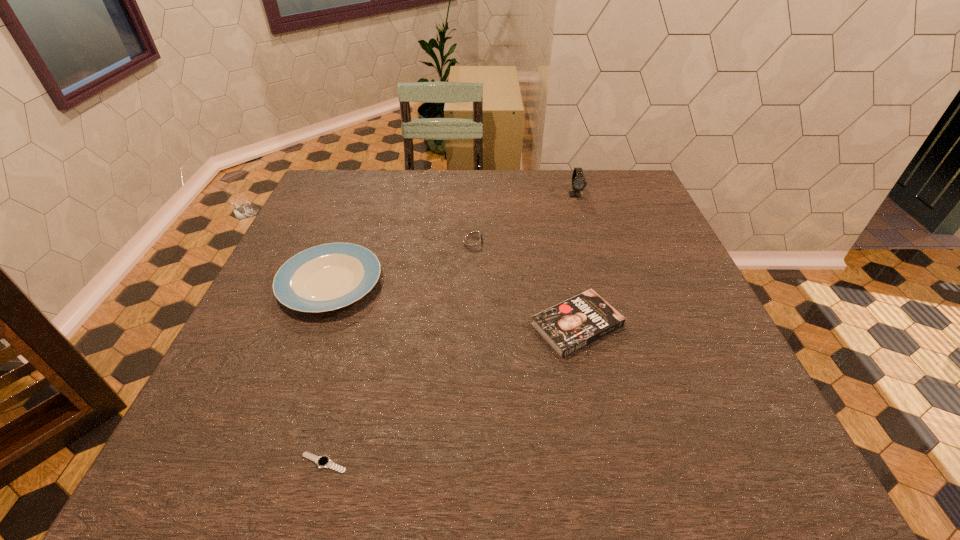
Find the location of `the farthest watch`. the farthest watch is located at coordinates (578, 180).

The height and width of the screenshot is (540, 960). In order to click on the farthest object in this screenshot , I will do `click(578, 180)`.

You are a GUI agent. You are given a task and a screenshot of the screen. Output one action in this format:
    pyautogui.click(x=<x>, y=<y>)
    Task: Click on the plate
    The image size is (960, 540).
    Given the screenshot: What is the action you would take?
    pyautogui.click(x=326, y=277)

This screenshot has height=540, width=960. In order to click on the second shortest watch in this screenshot , I will do pyautogui.click(x=473, y=240).

Identify the location of the third object from left to right. This screenshot has height=540, width=960. (473, 240).

You are a GUI agent. You are given a task and a screenshot of the screen. Output one action in this format:
    pyautogui.click(x=<x>, y=<y>)
    Task: Click on the book
    The height and width of the screenshot is (540, 960).
    Given the screenshot: What is the action you would take?
    577,322

Identify the location of the nearest object. (322, 461).

Identify the location of the shortest watch. The image size is (960, 540). (322, 461).

This screenshot has width=960, height=540. Find the location of `vacant space located on the face of the tallest object`. vacant space located on the face of the tallest object is located at coordinates (596, 264).

This screenshot has height=540, width=960. Find the location of `free region located 0.080m on the front of the plate`. free region located 0.080m on the front of the plate is located at coordinates (305, 351).